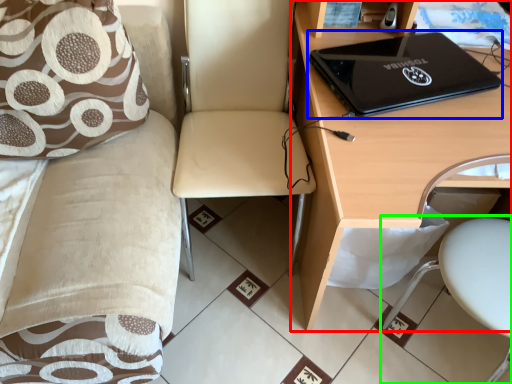
Question: Which object is positioned farthest from desk (highlighted by a red box)? Select from laptop (highlighted by a blue box) and swivel chair (highlighted by a green box).

Choices:
 (A) laptop
 (B) swivel chair

Answer: (B)